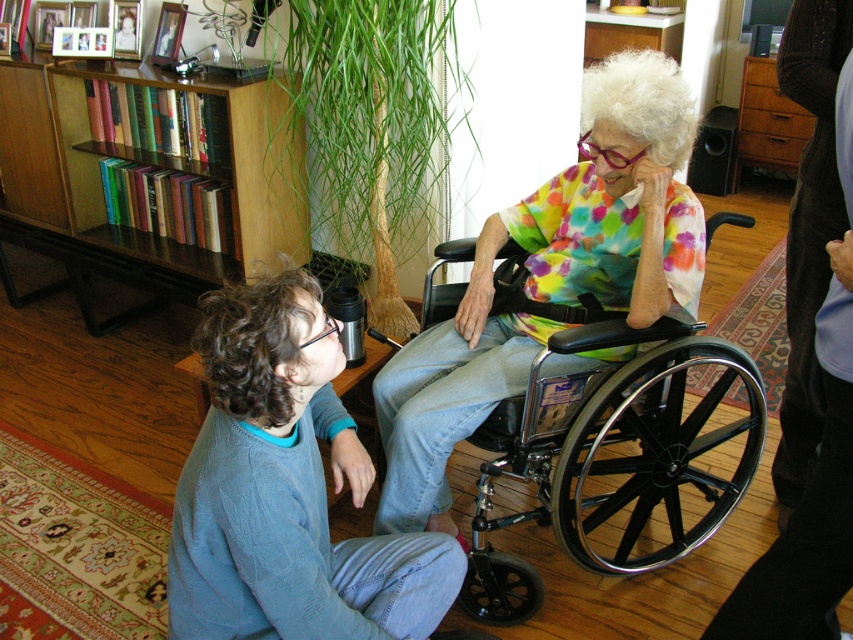
You are standing in the room and want to place a small potted plant between the two points, point (x=461, y=406) and point (x=67, y=173). Which point should the plant be closer to in order to be nearer to the camera?

The plant should be placed closer to point (x=461, y=406) because it is closer to the camera than point (x=67, y=173).